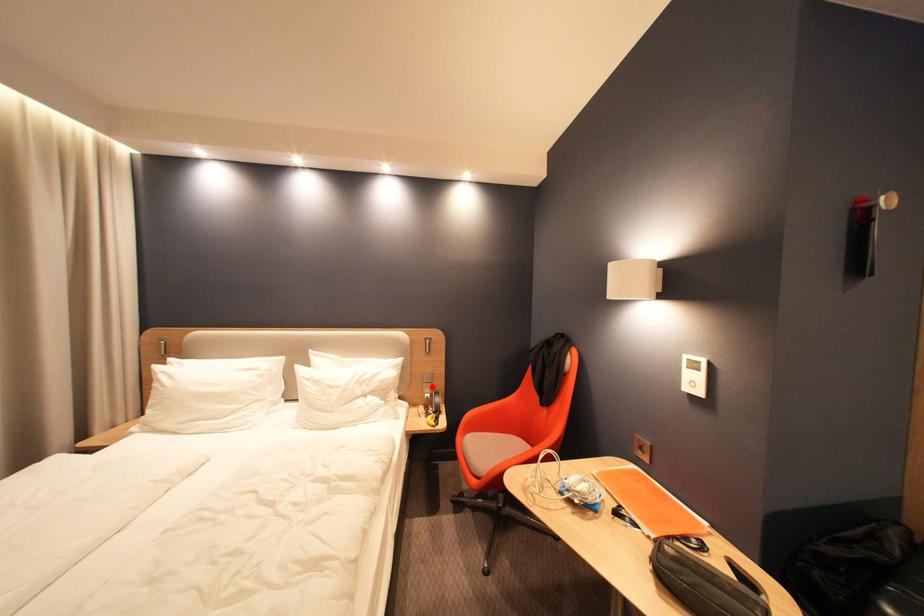
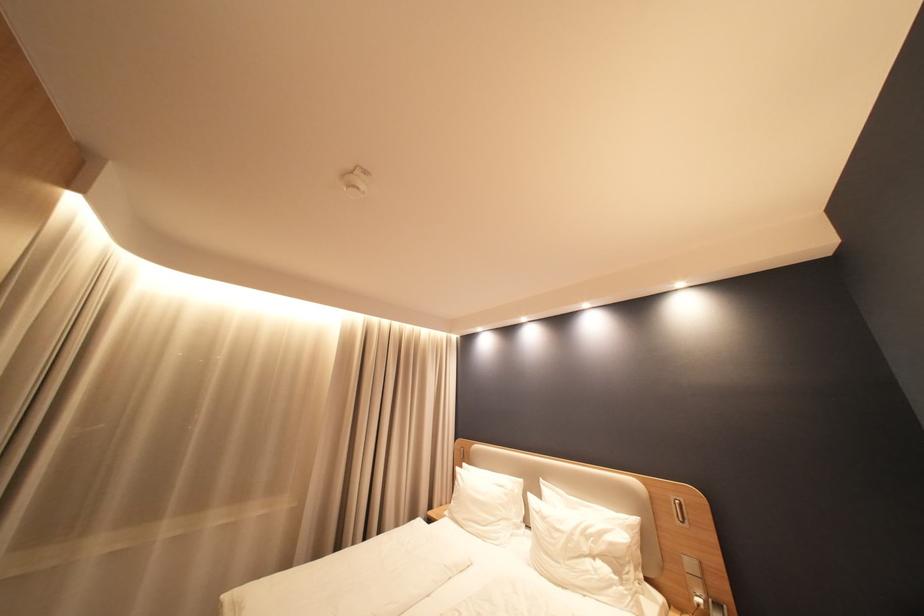
Where in the second image is the point corresponding to the highlighted location from the first image?

(696, 578)